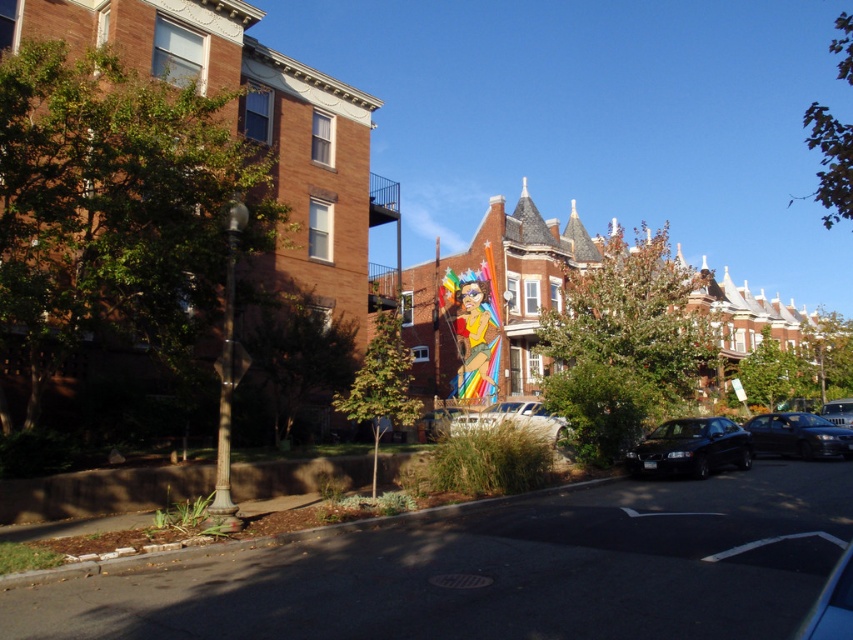
Question: Estimate the real-world distances between objects in this image. Which object is farther from the black glossy sedan at lower right?

Choices:
 (A) shiny black sedan at center right
 (B) metallic silver car at right
 (C) metallic silver car at center

Answer: (B)

Question: Is shiny black sedan at center right wider than metallic silver car at center?

Choices:
 (A) yes
 (B) no

Answer: (B)

Question: Where is black glossy sedan at lower right located in relation to metallic silver car at center in the image?

Choices:
 (A) right
 (B) left

Answer: (A)

Question: Which object appears closest to the camera in this image?

Choices:
 (A) shiny black sedan at center right
 (B) black glossy sedan at lower right
 (C) metallic silver car at right
 (D) metallic silver car at center

Answer: (D)

Question: Is black glossy sedan at lower right smaller than metallic silver car at right?

Choices:
 (A) no
 (B) yes

Answer: (A)

Question: Which is nearer to the shiny black sedan at center right?

Choices:
 (A) metallic silver car at right
 (B) metallic silver car at center
 (C) black glossy sedan at lower right

Answer: (C)